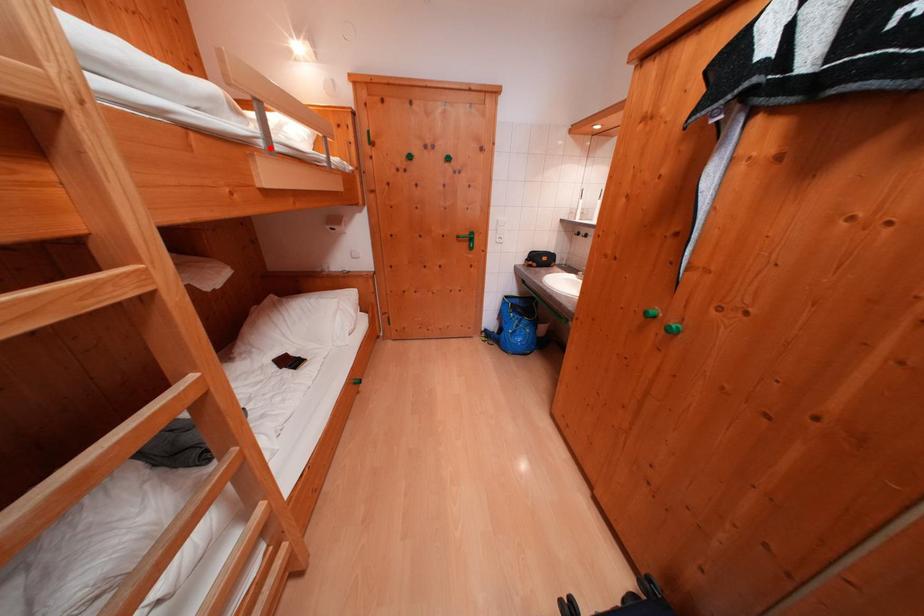
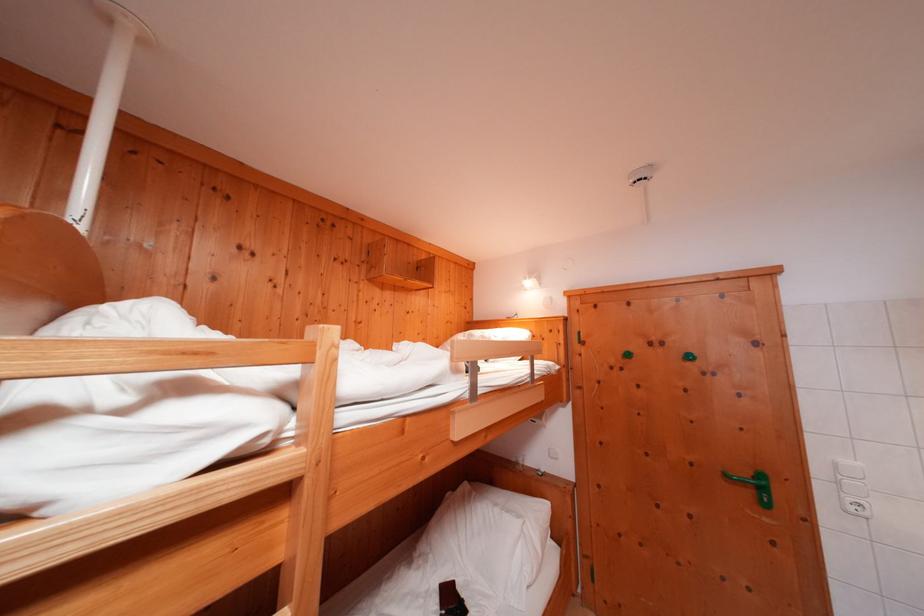
Locate, in the second image, the point that corresponds to the highlighted location in the first image.

(476, 399)